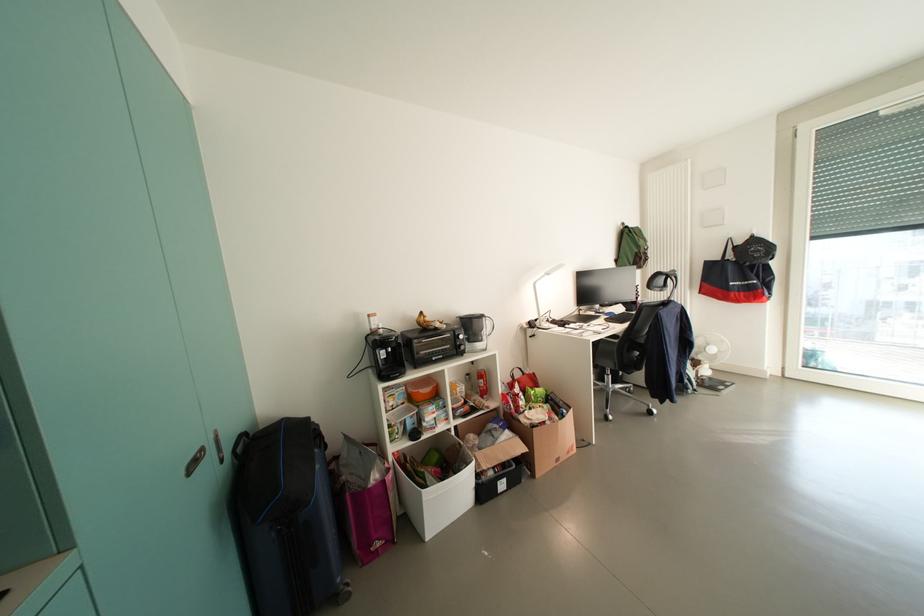
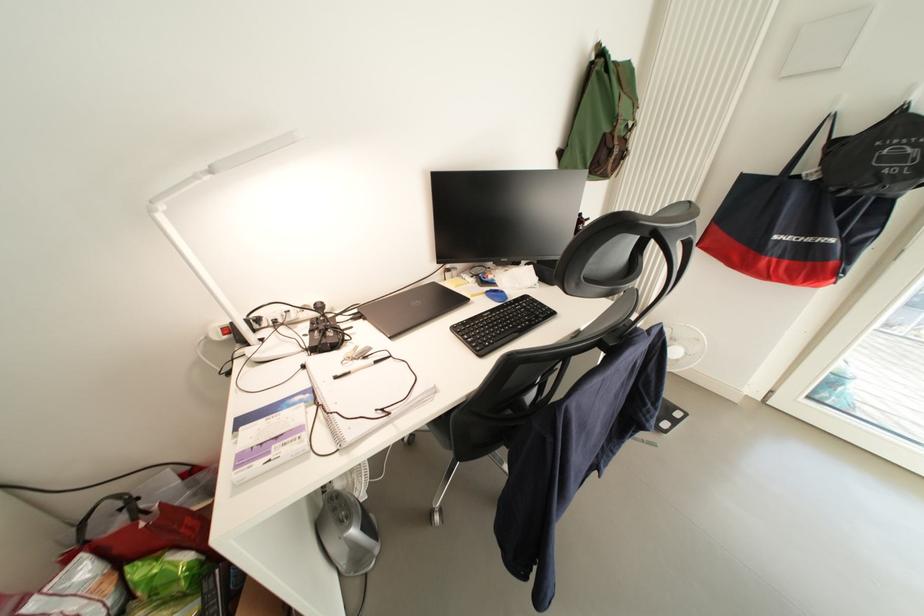
Where in the second image is the point corresponding to point 737,272 from the first image?

(801, 203)